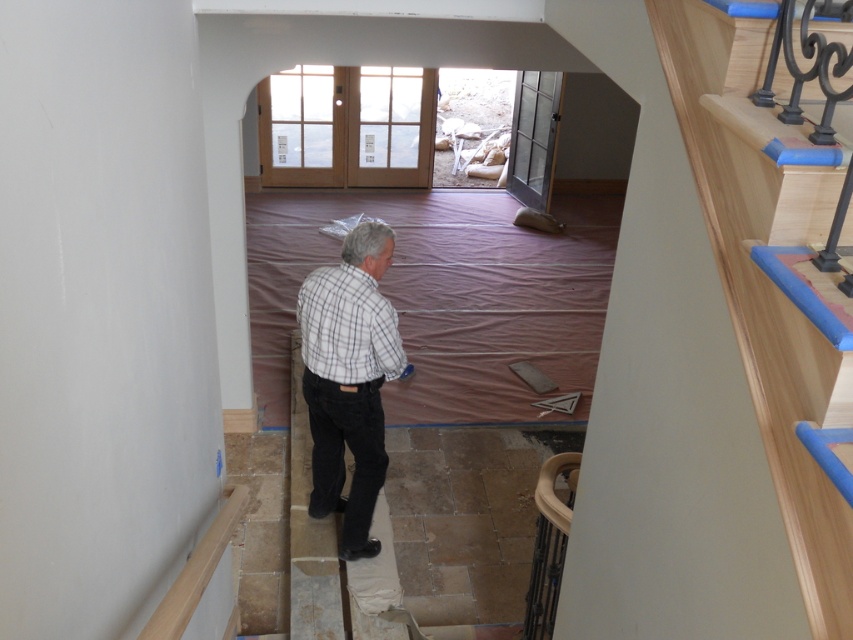
Is white checkered shirt at center positioned before plaid cotton shirt at center?

Yes, white checkered shirt at center is closer to the viewer.

Which is in front, point (357, 326) or point (328, 292)?

Point (357, 326) is more forward.

Does point (392, 332) lie behind point (329, 336)?

No, it is in front of (329, 336).

Where is `white checkered shirt at center`? This screenshot has width=853, height=640. white checkered shirt at center is located at coordinates (347, 380).